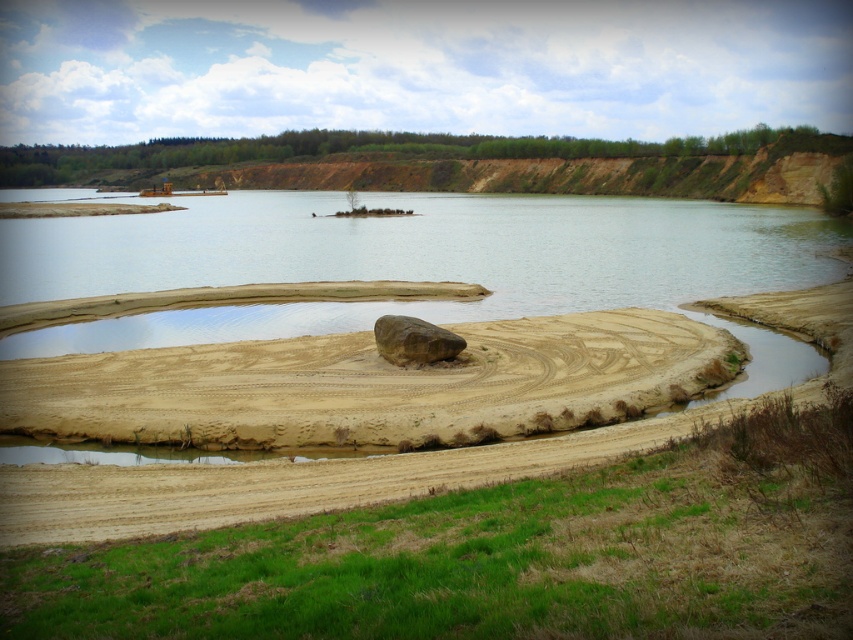
Question: Does brown sandy puddle at lower right have a lesser width compared to brown rough rock at center?

Choices:
 (A) no
 (B) yes

Answer: (A)

Question: Can you confirm if brown sandy dirt track at center is wider than brown sandy puddle at lower right?

Choices:
 (A) yes
 (B) no

Answer: (A)

Question: Among these objects, which one is nearest to the camera?

Choices:
 (A) brown rough rock at center
 (B) brown sandy dirt track at center
 (C) clear water at center
 (D) brown sandy puddle at lower right

Answer: (B)

Question: Which of the following is the farthest from the observer?

Choices:
 (A) (412, 355)
 (B) (553, 372)

Answer: (A)

Question: Which object appears farthest from the camera in this image?

Choices:
 (A) brown rough rock at center
 (B) brown sandy dirt track at center
 (C) clear water at center

Answer: (C)

Question: Can you confirm if clear water at center is bigger than brown sandy dirt track at center?

Choices:
 (A) no
 (B) yes

Answer: (B)